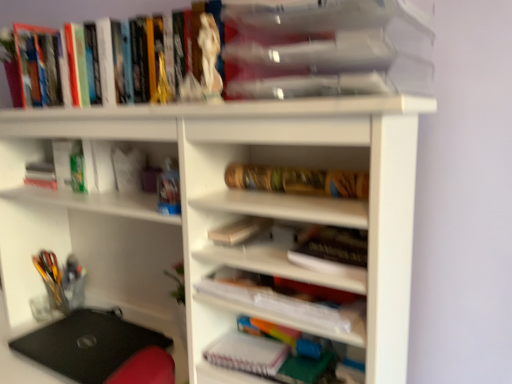
Question: Is hardcover books at upper left, which ranks as the sixth book in bottom-to-top order, outside wooden notebook at center-right, arranged as the 5th book when viewed from the top?

Choices:
 (A) yes
 (B) no

Answer: (A)

Question: Is hardcover books at upper left, marked as the 1th book in a top-to-bottom arrangement, shorter than wooden notebook at center-right, arranged as the 5th book when viewed from the top?

Choices:
 (A) no
 (B) yes

Answer: (A)

Question: Is there a large distance between hardcover books at upper left, which ranks as the sixth book in bottom-to-top order, and wooden notebook at center-right, arranged as the 5th book when viewed from the top?

Choices:
 (A) yes
 (B) no

Answer: (B)

Question: Could you tell me if hardcover books at upper left, which ranks as the sixth book in bottom-to-top order, is facing wooden notebook at center-right, placed as the second book when sorted from bottom to top?

Choices:
 (A) yes
 (B) no

Answer: (B)

Question: Is wooden notebook at center-right, arranged as the 5th book when viewed from the top, completely or partially inside hardcover books at upper left, marked as the 1th book in a top-to-bottom arrangement?

Choices:
 (A) no
 (B) yes

Answer: (A)

Question: Considering the positions of black matte laptop at lower left and wooden notebook at center-right, arranged as the 5th book when viewed from the top, in the image, is black matte laptop at lower left bigger or smaller than wooden notebook at center-right, arranged as the 5th book when viewed from the top,?

Choices:
 (A) small
 (B) big

Answer: (B)

Question: Is black matte laptop at lower left to the left or to the right of wooden notebook at center-right, arranged as the 5th book when viewed from the top, in the image?

Choices:
 (A) left
 (B) right

Answer: (A)

Question: Relative to wooden notebook at center-right, arranged as the 5th book when viewed from the top, is black matte laptop at lower left in front or behind?

Choices:
 (A) front
 (B) behind

Answer: (B)

Question: Looking at their shapes, would you say black matte laptop at lower left is wider or thinner than wooden notebook at center-right, placed as the second book when sorted from bottom to top?

Choices:
 (A) thin
 (B) wide

Answer: (B)

Question: In terms of size, does white matte notebook at lower center appear bigger or smaller than wooden notebook at center-right, placed as the second book when sorted from bottom to top?

Choices:
 (A) big
 (B) small

Answer: (A)

Question: In the image, is white matte notebook at lower center on the left side or the right side of wooden notebook at center-right, arranged as the 5th book when viewed from the top?

Choices:
 (A) left
 (B) right

Answer: (A)

Question: Considering the positions of white matte notebook at lower center and wooden notebook at center-right, arranged as the 5th book when viewed from the top, in the image, is white matte notebook at lower center taller or shorter than wooden notebook at center-right, arranged as the 5th book when viewed from the top,?

Choices:
 (A) short
 (B) tall

Answer: (A)

Question: Considering the positions of point (233, 337) and point (359, 274), is point (233, 337) closer or farther from the camera than point (359, 274)?

Choices:
 (A) farther
 (B) closer

Answer: (A)

Question: Would you say clear plastic container at upper center, marked as the second book in a top-to-bottom arrangement, is inside or outside hardcover books at upper left, marked as the 1th book in a top-to-bottom arrangement?

Choices:
 (A) outside
 (B) inside

Answer: (A)

Question: Considering the relative positions of clear plastic container at upper center, which is counted as the fifth book, starting from the bottom, and hardcover books at upper left, which ranks as the sixth book in bottom-to-top order, in the image provided, is clear plastic container at upper center, which is counted as the fifth book, starting from the bottom, to the left or to the right of hardcover books at upper left, which ranks as the sixth book in bottom-to-top order,?

Choices:
 (A) left
 (B) right

Answer: (B)